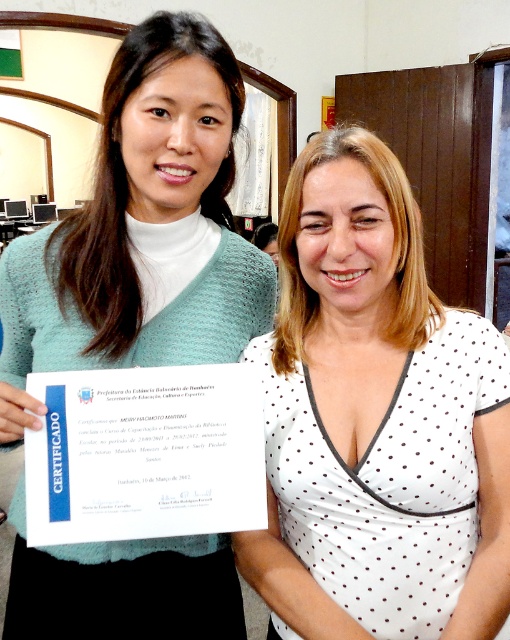
Does white dotted dress at center have a smaller size compared to teal knitted sweater at left?

Yes.

Can you confirm if white dotted dress at center is positioned to the right of teal knitted sweater at left?

Indeed, white dotted dress at center is positioned on the right side of teal knitted sweater at left.

At what (x,y) coordinates should I click in order to perform the action: click on white dotted dress at center. Please return your answer as a coordinate pair (x, y). The height and width of the screenshot is (640, 510). Looking at the image, I should click on (375, 420).